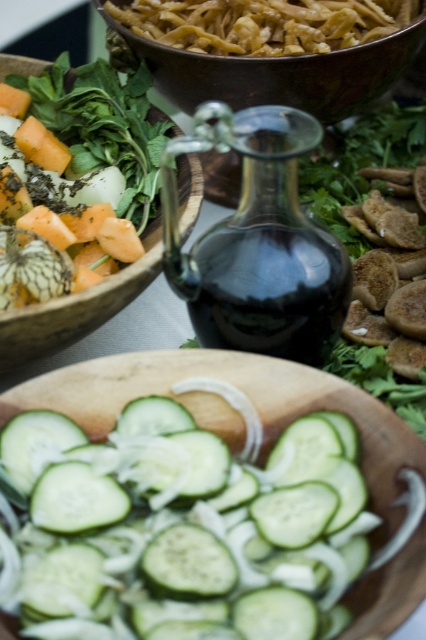
You are a chef preparing a dish and need to place a 12 inch long ingredient on the table. The ingredient must be placed on the matte brown bowl at upper center. Can you fit it on the bowl?

The matte brown bowl at upper center is 14.10 inches from viewer, so the 12 inch long ingredient can be placed on it since it is shorter than the bowl.

You are a photographer trying to capture the green smooth cucumber at center. If your camera can only focus on objects within 7 inches, will you need to adjust your focus?

The green smooth cucumber at center is 7.51 inches from the camera, which is beyond the 7 inches focus range. Therefore, you need to adjust your focus to capture it clearly.

You are a food photographer trying to capture the matte brown bowl at upper center. Your camera is set up at a standard height. Considering the bowl is 14.10 inches away from the camera, will the bowl fit entirely within the frame if your camera has a maximum horizontal field of view of 12 inches?

The matte brown bowl at upper center is 14.10 inches away from the camera, which exceeds the camera sensor maximum horizontal field of view of 12 inches. Therefore, the bowl will not fit entirely within the frame.